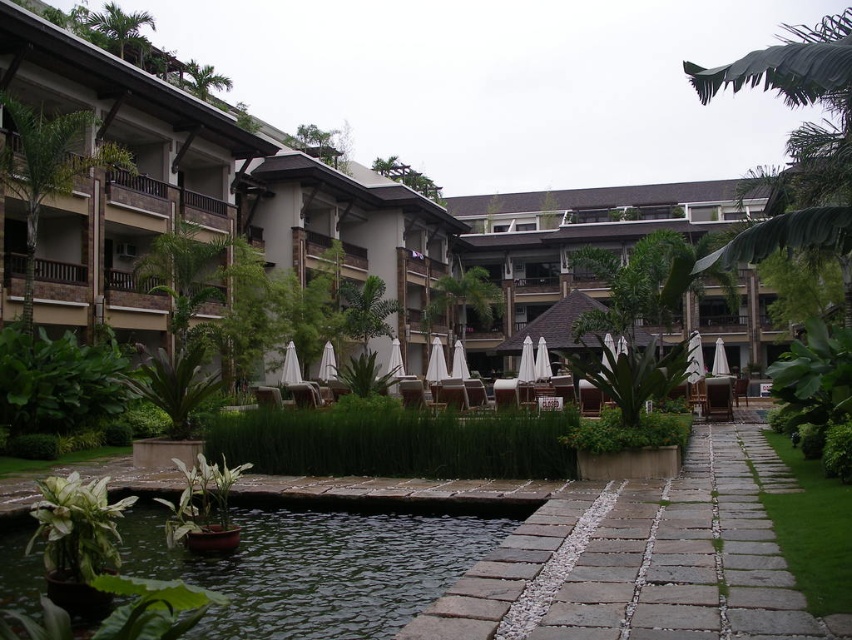
You are a guest staying at the brown textured resort at center and want to walk to the gray stone path at center. Is the resort wider than the path?

The brown textured resort at center might be wider than gray stone path at center, so it is possible that the resort is wider than the path.

You are a tour guide leading guests to the main building. You see the gray stone path at center and the white fabric umbrella at center. Which one is closer to the main building?

The gray stone path at center is closer to the main building than the white fabric umbrella at center because they are 44.45 meters apart.